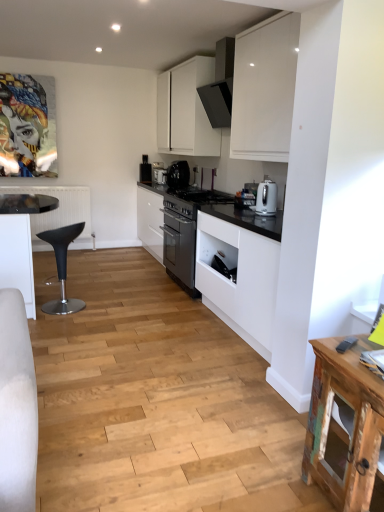
Question: Does white glossy coffee maker at center, the first kitchen appliance when ordered from left to right, have a larger size compared to satin silver kettle at right, the 1th kitchen appliance from the right?

Choices:
 (A) yes
 (B) no

Answer: (A)

Question: Considering the relative positions of white glossy coffee maker at center, the 3th kitchen appliance in the right-to-left sequence, and satin silver kettle at right, placed as the 1th kitchen appliance when sorted from bottom to top, in the image provided, is white glossy coffee maker at center, the 3th kitchen appliance in the right-to-left sequence, to the left of satin silver kettle at right, placed as the 1th kitchen appliance when sorted from bottom to top, from the viewer's perspective?

Choices:
 (A) yes
 (B) no

Answer: (A)

Question: Could you tell me if white glossy coffee maker at center, which ranks as the third kitchen appliance in front-to-back order, is facing satin silver kettle at right, which is the 3th kitchen appliance from left to right?

Choices:
 (A) no
 (B) yes

Answer: (A)

Question: Would you say white glossy coffee maker at center, the first kitchen appliance when ordered from left to right, contains satin silver kettle at right, which ranks as the 3th kitchen appliance in back-to-front order?

Choices:
 (A) yes
 (B) no

Answer: (B)

Question: Is the position of white glossy coffee maker at center, the 3th kitchen appliance in the right-to-left sequence, less distant than that of satin silver kettle at right, placed as the 1th kitchen appliance when sorted from bottom to top?

Choices:
 (A) yes
 (B) no

Answer: (B)

Question: From a real-world perspective, is black matte toaster at upper center positioned above or below white glossy coffee maker at center, which ranks as the third kitchen appliance in front-to-back order?

Choices:
 (A) above
 (B) below

Answer: (A)

Question: Choose the correct answer: Is black matte toaster at upper center inside white glossy coffee maker at center, acting as the 3th kitchen appliance starting from the bottom, or outside it?

Choices:
 (A) inside
 (B) outside

Answer: (B)

Question: Is black matte toaster at upper center to the left or to the right of white glossy coffee maker at center, the 3th kitchen appliance in the right-to-left sequence, in the image?

Choices:
 (A) left
 (B) right

Answer: (A)

Question: From their relative heights in the image, would you say black matte toaster at upper center is taller or shorter than white glossy coffee maker at center, the 3th kitchen appliance in the right-to-left sequence?

Choices:
 (A) tall
 (B) short

Answer: (A)

Question: Looking at the image, does satin silver kettle at right, which ranks as the 3th kitchen appliance in back-to-front order, seem bigger or smaller compared to white matte cabinet at upper center?

Choices:
 (A) small
 (B) big

Answer: (A)

Question: From a real-world perspective, is satin silver kettle at right, which is the 1th kitchen appliance in front-to-back order, positioned above or below white matte cabinet at upper center?

Choices:
 (A) above
 (B) below

Answer: (B)

Question: Looking at their shapes, would you say satin silver kettle at right, which ranks as the 3th kitchen appliance in back-to-front order, is wider or thinner than white matte cabinet at upper center?

Choices:
 (A) wide
 (B) thin

Answer: (B)

Question: Which is correct: satin silver kettle at right, the 1th kitchen appliance from the right, is inside white matte cabinet at upper center, or outside of it?

Choices:
 (A) outside
 (B) inside

Answer: (A)

Question: Looking at their shapes, would you say black plastic bar stool at left is wider or thinner than white matte cabinet at upper center?

Choices:
 (A) wide
 (B) thin

Answer: (B)

Question: From a real-world perspective, is black plastic bar stool at left above or below white matte cabinet at upper center?

Choices:
 (A) above
 (B) below

Answer: (B)